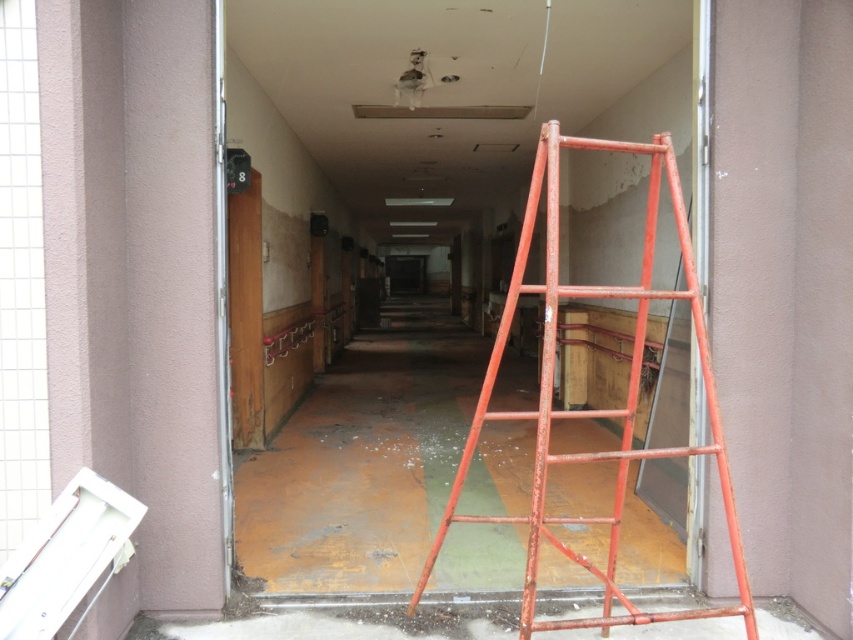
You are a maintenance worker needing to enter a restricted area through the rusty metal door at left. However, there is also a rusty metal ladder at right nearby. Considering their sizes, which object might be easier to maneuver around in this narrow corridor?

The rusty metal door at left is narrower than the rusty metal ladder at right, so it would be easier to maneuver around the rusty metal door at left in the narrow corridor.

You are a maintenance worker in a dilapidated corridor. You see a rusty metal ladder at right and a rusty metal door at left. Which object is positioned to the right of the other?

The rusty metal ladder at right is positioned to the right of the rusty metal door at left.